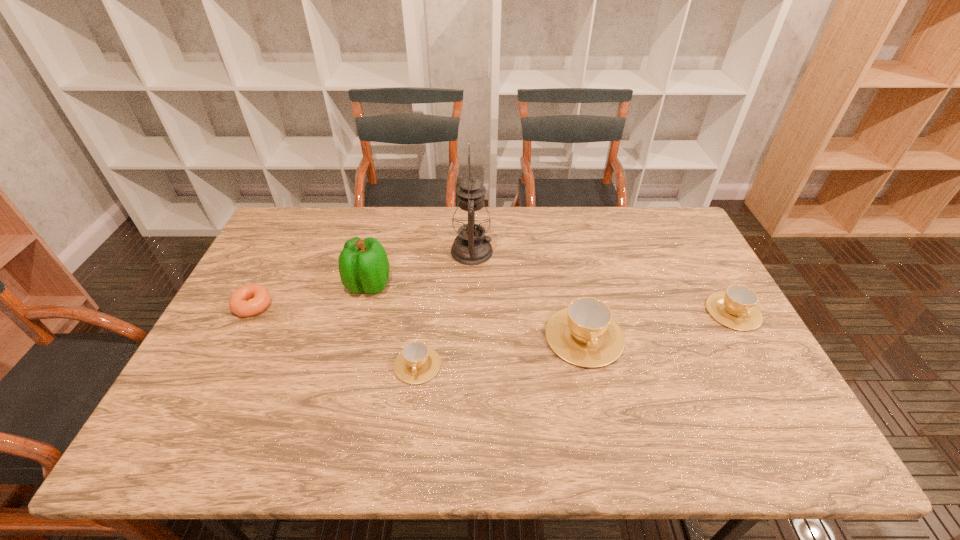
Locate an element on the screen. The image size is (960, 540). object that is at the right edge is located at coordinates (736, 308).

Find the location of a particular element. Image resolution: width=960 pixels, height=540 pixels. vacant space at the far edge of the desktop is located at coordinates coord(353,217).

Locate an element on the screen. vacant region at the near edge of the desktop is located at coordinates (654, 393).

This screenshot has height=540, width=960. I want to click on vacant space at the left edge, so click(244, 326).

In the image, there is a desktop. Identify the location of free space at the far left corner. (290, 236).

At what (x,y) coordinates should I click in order to perform the action: click on vacant area that lies between the second object from left to right and the second object from right to left. Please return your answer as a coordinate pair (x, y). The width and height of the screenshot is (960, 540). Looking at the image, I should click on (476, 310).

What are the coordinates of `free spot between the second cup from left to right and the oil lamp` in the screenshot? It's located at (528, 294).

This screenshot has height=540, width=960. I want to click on free space between the tallest cup and the doughnut, so click(x=419, y=321).

Locate an element on the screen. The height and width of the screenshot is (540, 960). vacant space in between the rightmost object and the second object from right to left is located at coordinates (659, 324).

Where is `free space between the leftmost object and the second cup from left to right`? free space between the leftmost object and the second cup from left to right is located at coordinates (419, 321).